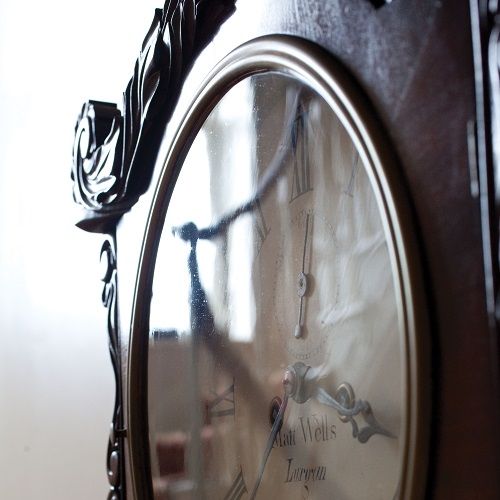
Locate an element on the screen. wall is located at coordinates (57, 393), (77, 35).